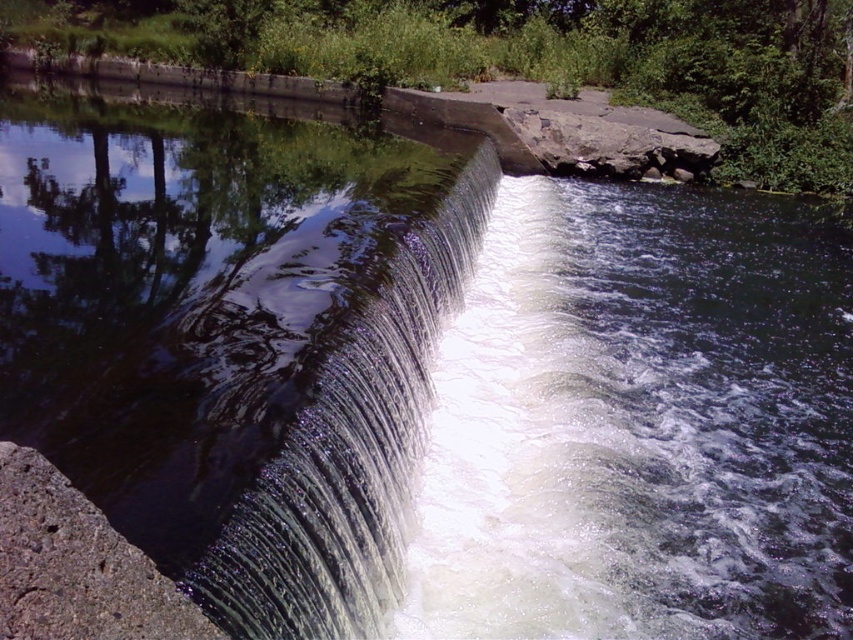
Does green leafy tree at upper left appear on the right side of clear glass waterfall at center?

Incorrect, green leafy tree at upper left is not on the right side of clear glass waterfall at center.

Is point (723, 179) less distant than point (357, 412)?

No, (723, 179) is behind (357, 412).

Image resolution: width=853 pixels, height=640 pixels. In order to click on green leafy tree at upper left in this screenshot , I will do `click(527, 58)`.

Is clear glass waterfall at center closer to the viewer compared to gray rough concrete at lower left?

No, clear glass waterfall at center is further to the viewer.

Who is lower down, clear glass waterfall at center or gray rough concrete at lower left?

gray rough concrete at lower left is below.

Is point (331, 524) more distant than point (117, 584)?

Yes, it is.

Locate an element on the screen. clear glass waterfall at center is located at coordinates (349, 451).

Between green leafy tree at upper left and gray rough concrete at lower left, which one is positioned higher?

green leafy tree at upper left

Is green leafy tree at upper left closer to the viewer compared to gray rough concrete at lower left?

No, green leafy tree at upper left is behind gray rough concrete at lower left.

The width and height of the screenshot is (853, 640). What do you see at coordinates (527, 58) in the screenshot? I see `green leafy tree at upper left` at bounding box center [527, 58].

Locate an element on the screen. The height and width of the screenshot is (640, 853). green leafy tree at upper left is located at coordinates (527, 58).